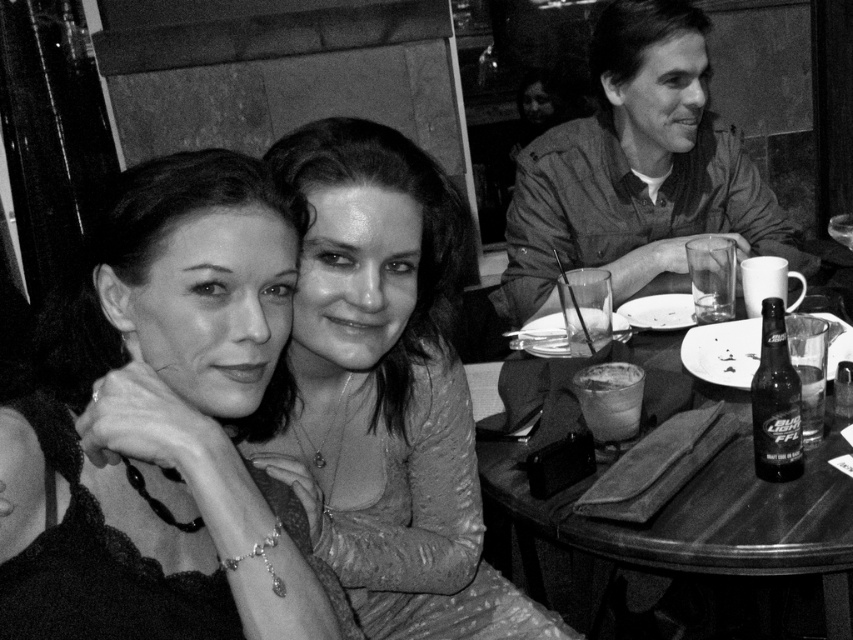
Can you confirm if smooth silk blouse at center is smaller than matte khaki shirt at upper right?

Incorrect, smooth silk blouse at center is not smaller in size than matte khaki shirt at upper right.

Between point (297, 161) and point (664, 90), which one is positioned in front?

Point (297, 161)

Where is `smooth silk blouse at center`? This screenshot has height=640, width=853. smooth silk blouse at center is located at coordinates (387, 392).

Is smooth skin at center positioned before matte khaki shirt at upper right?

Yes, it is.

This screenshot has width=853, height=640. I want to click on smooth skin at center, so click(x=163, y=424).

Is point (573, 234) closer to camera compared to point (657, 580)?

Yes, point (573, 234) is closer to viewer.

Locate an element on the screen. Image resolution: width=853 pixels, height=640 pixels. matte khaki shirt at upper right is located at coordinates (637, 168).

Where is `matte khaki shirt at upper right`? matte khaki shirt at upper right is located at coordinates (637, 168).